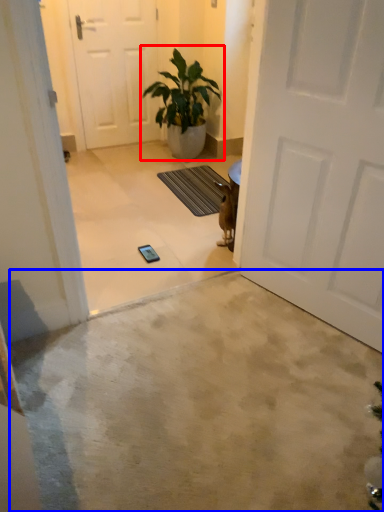
Question: Which object is further to the camera taking this photo, houseplant (highlighted by a red box) or concrete (highlighted by a blue box)?

Choices:
 (A) houseplant
 (B) concrete

Answer: (A)